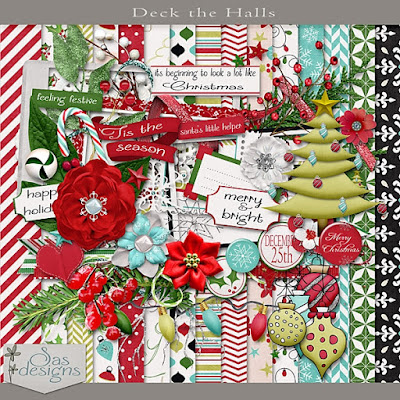
Find the location of a particular element. This screenshot has width=400, height=400. halls is located at coordinates (229, 11).